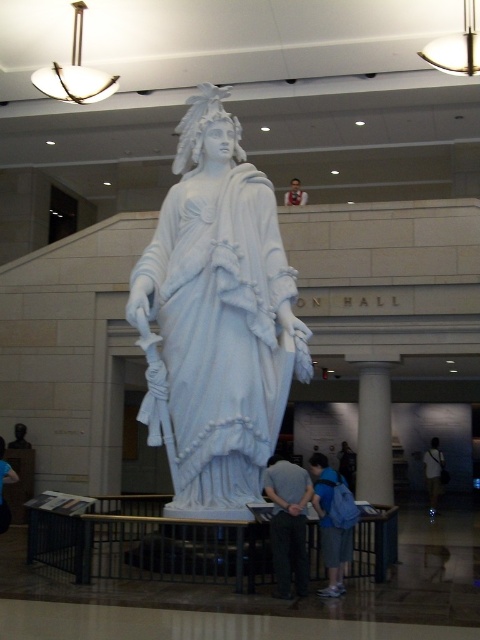
Question: Does white marble pillar at center appear on the right side of light brown wooden frame at upper center?

Choices:
 (A) no
 (B) yes

Answer: (B)

Question: Which point is farther to the camera?

Choices:
 (A) dark blue backpack at lower right
 (B) blue denim jeans at lower left
 (C) light brown wooden frame at upper center
 (D) blue backpack at lower center

Answer: (A)

Question: Which point appears farthest from the camera in this image?

Choices:
 (A) (2, 467)
 (B) (288, 202)
 (C) (335, 541)

Answer: (B)

Question: Which of these objects is positioned closest to the dark blue backpack at lower right?

Choices:
 (A) gray fabric pants at lower center
 (B) white marble pillar at center
 (C) white marble statue at center

Answer: (B)

Question: Can you confirm if blue denim jeans at lower left is positioned below light brown wooden frame at upper center?

Choices:
 (A) no
 (B) yes

Answer: (B)

Question: Is white marble pillar at center to the right of light brown wooden frame at upper center from the viewer's perspective?

Choices:
 (A) no
 (B) yes

Answer: (B)